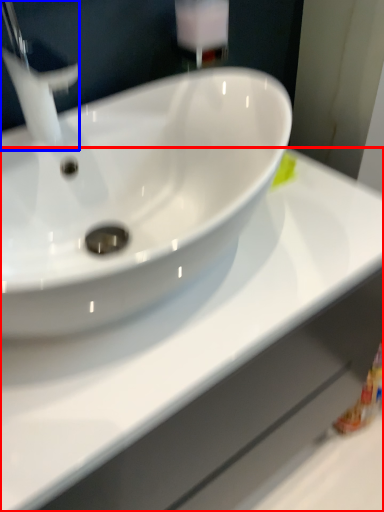
Question: Among these objects, which one is nearest to the camera, counter top (highlighted by a red box) or tap (highlighted by a blue box)?

Choices:
 (A) counter top
 (B) tap

Answer: (A)